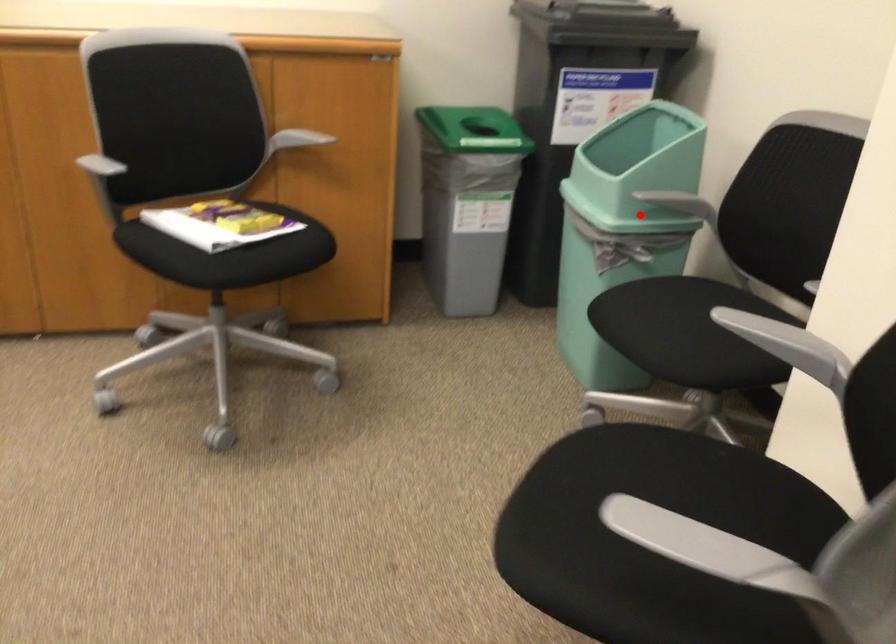
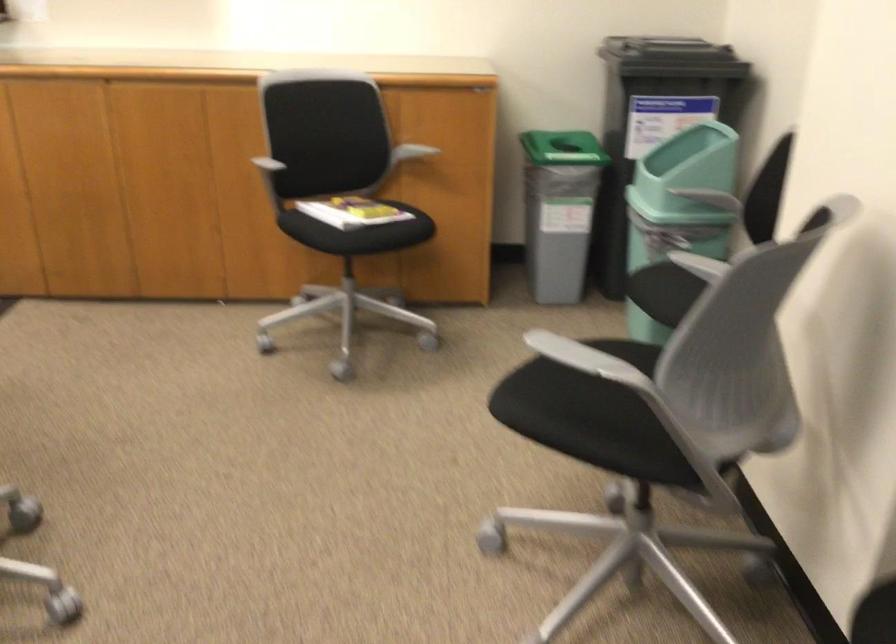
Locate, in the second image, the point that corresponds to the highlighted location in the first image.

(678, 207)